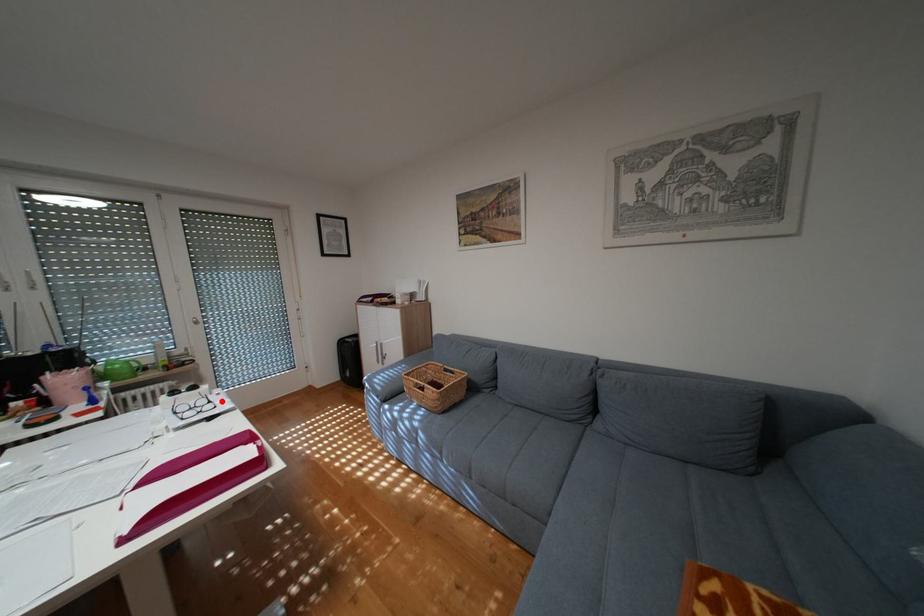
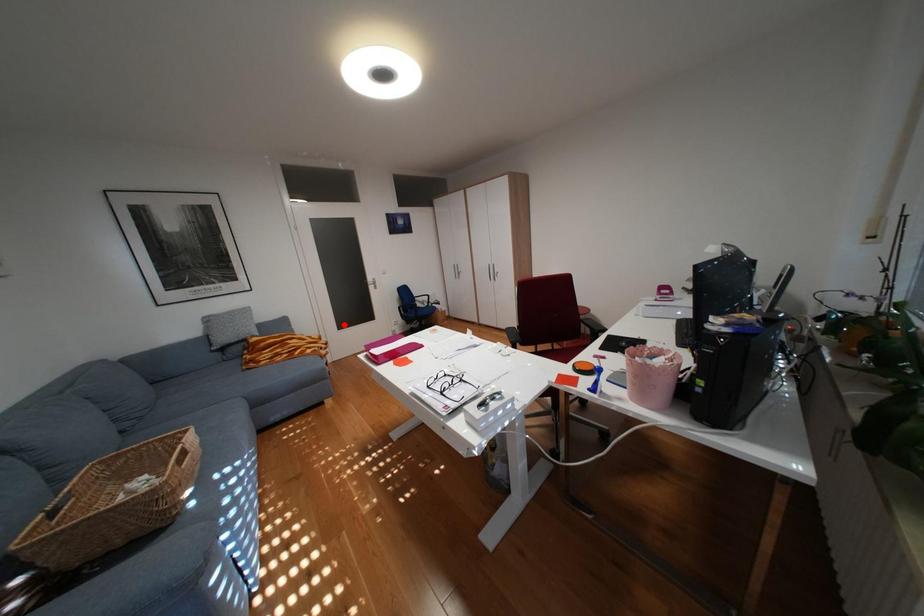
I am providing you with two images of the same scene from different viewpoints. A red point is marked on the first image and another point is marked on the second image. Is the red point in image1 aligned with the point shown in image2?

No